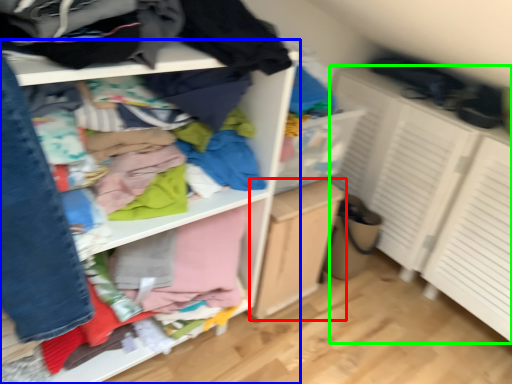
Question: Based on their relative distances, which object is nearer to file cabinet (highlighted by a red box)? Choose from shelf (highlighted by a blue box) and cabinetry (highlighted by a green box).

Choices:
 (A) shelf
 (B) cabinetry

Answer: (A)